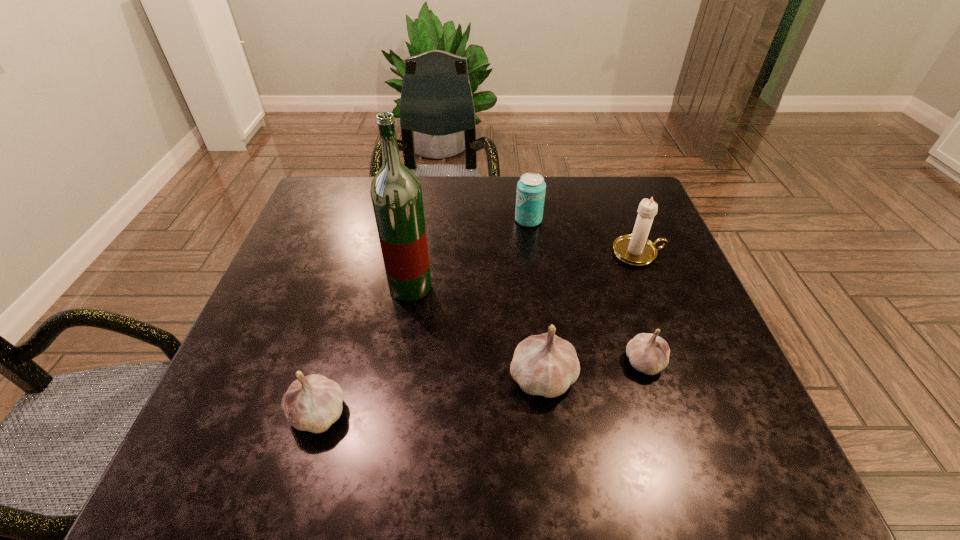
The width and height of the screenshot is (960, 540). What are the coordinates of `vacant space located on the back of the shortest object` in the screenshot? It's located at (630, 314).

What are the coordinates of `free spot located 0.220m on the front of the fourth nearest object` in the screenshot? It's located at (395, 390).

Identify the location of vacant area situated on the front of the farthest object. The height and width of the screenshot is (540, 960). (532, 246).

This screenshot has height=540, width=960. Find the location of `object located in the far edge section of the desktop`. object located in the far edge section of the desktop is located at coordinates (531, 188).

This screenshot has height=540, width=960. I want to click on object situated at the left edge, so click(313, 403).

In order to click on garlic that is at the right edge in this screenshot , I will do `click(648, 353)`.

Locate an element on the screen. The height and width of the screenshot is (540, 960). candle holder that is at the right edge is located at coordinates (636, 249).

You are a GUI agent. You are given a task and a screenshot of the screen. Output one action in this format:
    pyautogui.click(x=<x>, y=<y>)
    Task: Click on the object that is at the near left corner
    The height and width of the screenshot is (540, 960).
    Given the screenshot: What is the action you would take?
    pyautogui.click(x=313, y=403)

You are a GUI agent. You are given a task and a screenshot of the screen. Output one action in this format:
    pyautogui.click(x=<x>, y=<y>)
    Task: Click on the object located at the near right corner
    
    Given the screenshot: What is the action you would take?
    pyautogui.click(x=648, y=353)

In the image, there is a desktop. At what (x,y) coordinates should I click in order to perform the action: click on vacant region at the far edge. Please return your answer as a coordinate pair (x, y). This screenshot has width=960, height=540. Looking at the image, I should click on (450, 194).